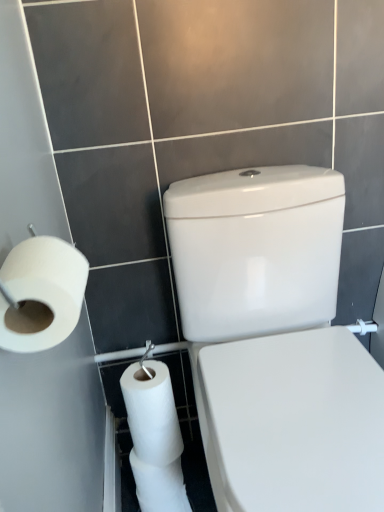
Find the location of a particular element. The image size is (384, 512). white glossy porcelain at center is located at coordinates (275, 341).

Image resolution: width=384 pixels, height=512 pixels. What do you see at coordinates (275, 341) in the screenshot?
I see `white glossy porcelain at center` at bounding box center [275, 341].

The image size is (384, 512). What do you see at coordinates (41, 293) in the screenshot? I see `white matte toilet paper at left` at bounding box center [41, 293].

The image size is (384, 512). Find the location of `white matte toilet paper at left`. white matte toilet paper at left is located at coordinates 41,293.

Locate an element on the screen. The height and width of the screenshot is (512, 384). white glossy porcelain at center is located at coordinates (275, 341).

Would you say white glossy porcelain at center is to the left or to the right of white matte toilet paper at left in the picture?

white glossy porcelain at center is positioned on white matte toilet paper at left's right side.

Does white glossy porcelain at center come behind white matte toilet paper at left?

No, white glossy porcelain at center is closer to the camera.

Is point (217, 360) positioned before point (16, 331)?

No, (217, 360) is further to viewer.

From the image's perspective, between white glossy porcelain at center and white matte toilet paper at left, which one is located above?

From the image's view, white matte toilet paper at left is above.

Based on the photo, from a real-world perspective, who is located lower, white glossy porcelain at center or white matte toilet paper at left?

From a 3D spatial view, white glossy porcelain at center is below.

Between white glossy porcelain at center and white matte toilet paper at left, which one has larger width?

Wider between the two is white glossy porcelain at center.

In terms of height, does white glossy porcelain at center look taller or shorter compared to white matte toilet paper at left?

white glossy porcelain at center is taller than white matte toilet paper at left.

Who is smaller, white glossy porcelain at center or white matte toilet paper at left?

With smaller size is white matte toilet paper at left.

Would you say white glossy porcelain at center is outside white matte toilet paper at left?

That's correct, white glossy porcelain at center is outside of white matte toilet paper at left.

Is white glossy porcelain at center far from white matte toilet paper at left?

No, white glossy porcelain at center is not far from white matte toilet paper at left.

Is white glossy porcelain at center positioned with its back to white matte toilet paper at left?

No, white matte toilet paper at left is not at the back of white glossy porcelain at center.

Consider the image. Can you tell me how much white glossy porcelain at center and white matte toilet paper at left differ in facing direction?

89.1 degrees separate the facing orientations of white glossy porcelain at center and white matte toilet paper at left.

Identify the location of porcelain beneath the white matte toilet paper at left (from a real-world perspective). (275, 341).

Considering the relative positions of white matte toilet paper at left and white glossy porcelain at center in the image provided, is white matte toilet paper at left to the right of white glossy porcelain at center from the viewer's perspective?

No.

Which object is more forward, white matte toilet paper at left or white glossy porcelain at center?

white glossy porcelain at center.

Does point (83, 284) lie behind point (233, 450)?

No, it is not.

From the image's perspective, would you say white matte toilet paper at left is shown under white glossy porcelain at center?

Incorrect, from the image's perspective, white matte toilet paper at left is higher than white glossy porcelain at center.

From a real-world perspective, is white matte toilet paper at left located beneath white glossy porcelain at center?

No, from a real-world perspective, white matte toilet paper at left is not beneath white glossy porcelain at center.

In terms of width, does white matte toilet paper at left look wider or thinner when compared to white glossy porcelain at center?

In the image, white matte toilet paper at left appears to be more narrow than white glossy porcelain at center.

Can you confirm if white matte toilet paper at left is taller than white glossy porcelain at center?

No.

Does white matte toilet paper at left have a larger size compared to white glossy porcelain at center?

No.

Would you say white matte toilet paper at left is outside white glossy porcelain at center?

Indeed, white matte toilet paper at left is completely outside white glossy porcelain at center.

Is white matte toilet paper at left positioned far away from white glossy porcelain at center?

No, white matte toilet paper at left is not far away from white glossy porcelain at center.

Is white matte toilet paper at left oriented towards white glossy porcelain at center?

Yes.

The width and height of the screenshot is (384, 512). In order to click on porcelain on the right of white matte toilet paper at left in this screenshot , I will do `click(275, 341)`.

Where is `porcelain to the right of white matte toilet paper at left`? This screenshot has width=384, height=512. porcelain to the right of white matte toilet paper at left is located at coordinates (275, 341).

Where is `toilet paper behind the white glossy porcelain at center`? This screenshot has width=384, height=512. toilet paper behind the white glossy porcelain at center is located at coordinates (41, 293).